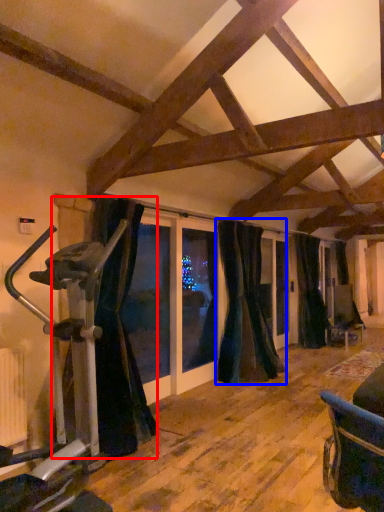
Question: Which object appears closest to the camera in this image, curtain (highlighted by a red box) or curtain (highlighted by a blue box)?

Choices:
 (A) curtain
 (B) curtain

Answer: (A)